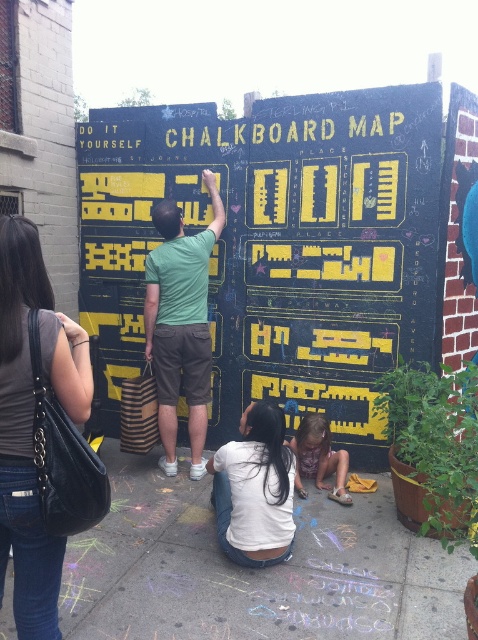
Looking at this image, you are a photographer taking a picture of the green matte shirt at center and the matte purple dress at lower center. To ensure both are in frame, should you position the camera to the left or right of the scene?

The green matte shirt at center is to the left of the matte purple dress at lower center, so positioning the camera to the right of the scene would ensure both are in frame.

You are standing in the scene and want to pick up the dark gray leather handbag at lower left. Can you reach it without moving the white cotton shirt at lower center?

Yes, you can reach the dark gray leather handbag at lower left without moving the white cotton shirt at lower center because the handbag is in front of the shirt, making it accessible.